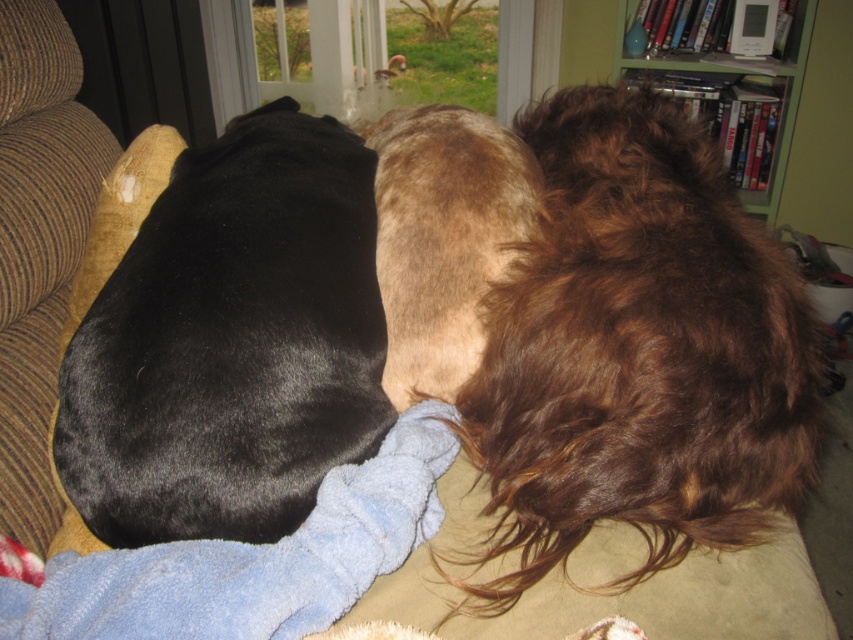
Which of these two, black fur dog at left or transparent glass door at upper center, stands shorter?

transparent glass door at upper center

Image resolution: width=853 pixels, height=640 pixels. What do you see at coordinates (231, 342) in the screenshot? I see `black fur dog at left` at bounding box center [231, 342].

Where is `black fur dog at left`? black fur dog at left is located at coordinates (231, 342).

Between brown fuzzy dog at center and transparent glass door at upper center, which one has more height?

brown fuzzy dog at center is taller.

Consider the image. Does brown fuzzy dog at center appear on the right side of transparent glass door at upper center?

Indeed, brown fuzzy dog at center is positioned on the right side of transparent glass door at upper center.

Which is behind, point (463, 109) or point (221, 6)?

Point (221, 6)

Locate an element on the screen. This screenshot has height=640, width=853. brown fuzzy dog at center is located at coordinates click(444, 237).

Measure the distance between point [666,504] and camera.

Point [666,504] is 92.77 centimeters from camera.

Between point (698, 349) and point (338, 176), which one is positioned in front?

Point (698, 349) is more forward.

Identify the location of brown fluffy dog at center. (637, 353).